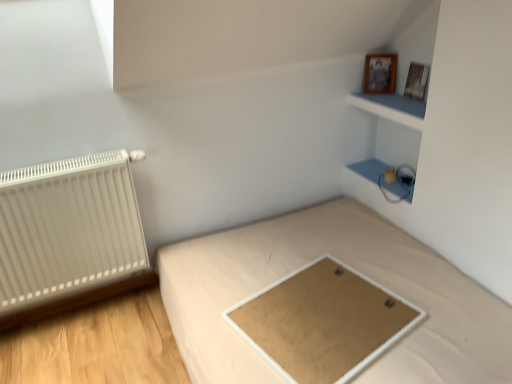
What are the coordinates of `vacant area on top of light brown fabric bed at center (from a real-world perspective)` in the screenshot? It's located at (314, 298).